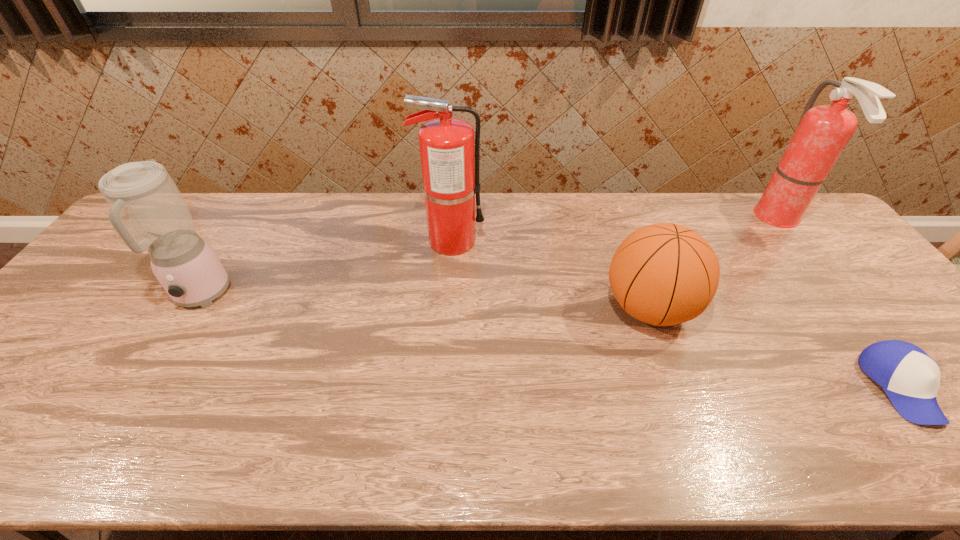
Find the location of a particular element. This screenshot has width=960, height=540. vacant space positioned 0.180m on the base of the third shortest object near the control knob is located at coordinates (147, 384).

Find the location of a particular element. The width and height of the screenshot is (960, 540). vacant region located on the left of the basketball is located at coordinates (520, 308).

Locate an element on the screen. This screenshot has height=540, width=960. object present at the right edge is located at coordinates (823, 132).

The image size is (960, 540). Find the location of `object present at the far right corner`. object present at the far right corner is located at coordinates [823, 132].

Where is `vacant space at the far edge`? This screenshot has height=540, width=960. vacant space at the far edge is located at coordinates (247, 195).

This screenshot has height=540, width=960. Find the location of `free space at the near edge of the desktop`. free space at the near edge of the desktop is located at coordinates [49, 443].

The image size is (960, 540). In the image, there is a desktop. In order to click on free space at the far right corner in this screenshot , I will do `click(811, 213)`.

What are the coordinates of `free spot between the second object from left to right and the right fire extinguisher` in the screenshot? It's located at (615, 230).

The width and height of the screenshot is (960, 540). In order to click on free space between the third tallest object and the left fire extinguisher in this screenshot , I will do `click(325, 268)`.

Identify the location of free space between the basketball and the leftmost object. (424, 302).